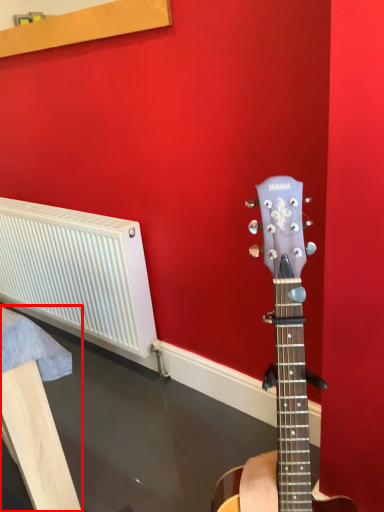
Question: From the image, what is the correct spatial relationship of furniture (annotated by the red box) in relation to radiator?

Choices:
 (A) left
 (B) right

Answer: (A)